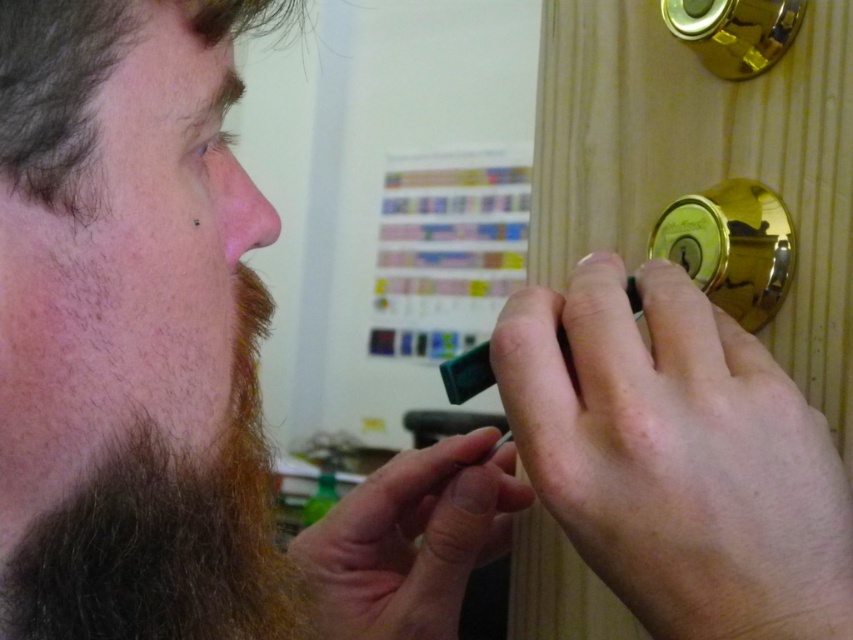
You are a locksmith trying to open a locked cabinet. You see the smooth gold doorknob at right and the gold shiny door handle at upper right. Which object is closer to your hand if you are standing directly in front of the cabinet?

The smooth gold doorknob at right is closer to your hand than the gold shiny door handle at upper right because they are 18.96 centimeters apart.

You are a locksmith trying to open a lock. You have a smooth plastic toothpick at center and a smooth gold doorknob at right. Which object is more suitable for picking the lock?

The smooth plastic toothpick at center is more suitable for picking the lock because it is smaller than the smooth gold doorknob at right, making it easier to manipulate in the keyhole.